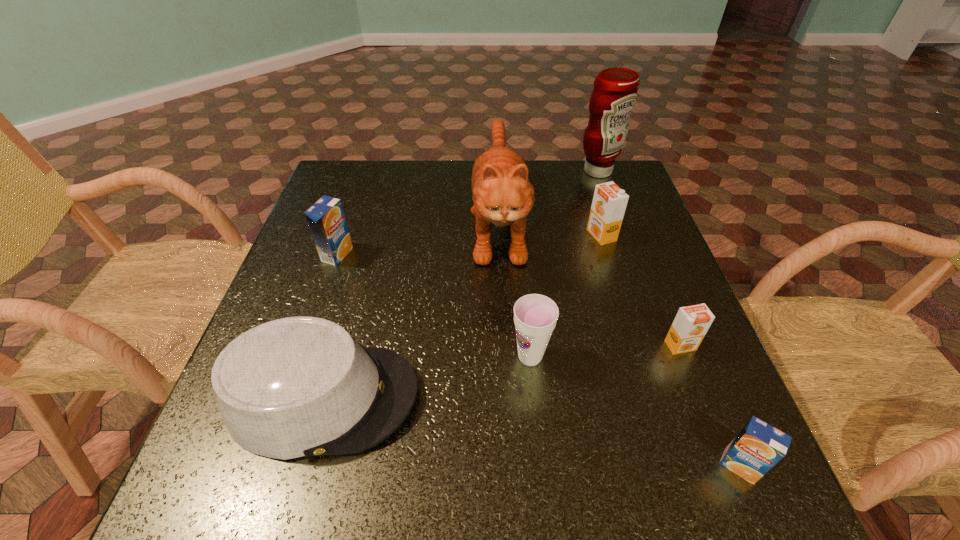
Where is `free spot at the far edge of the desktop`? The image size is (960, 540). free spot at the far edge of the desktop is located at coordinates (419, 195).

Find the location of a particular element. The image size is (960, 540). free spot at the left edge of the desktop is located at coordinates (359, 221).

Image resolution: width=960 pixels, height=540 pixels. I want to click on vacant space at the right edge of the desktop, so click(648, 368).

In the image, there is a desktop. At what (x,y) coordinates should I click in order to perform the action: click on vacant space at the far left corner. Please return your answer as a coordinate pair (x, y). Looking at the image, I should click on point(339,198).

This screenshot has height=540, width=960. I want to click on free location at the near left corner of the desktop, so click(287, 515).

Find the location of a particular element. This screenshot has height=540, width=960. free space at the far right corner of the desktop is located at coordinates (583, 190).

What are the coordinates of `empty location between the condiment and the nearer blue orange_juice` in the screenshot? It's located at (669, 319).

Locate an element on the screen. The image size is (960, 540). empty space between the orange cat and the bigger orange orange juice is located at coordinates (550, 229).

Where is `vacant point located between the orange cat and the hat`? The width and height of the screenshot is (960, 540). vacant point located between the orange cat and the hat is located at coordinates (411, 310).

At what (x,y) coordinates should I click in order to perform the action: click on free spot between the nearer blue orange_juice and the hat. Please return your answer as a coordinate pair (x, y). Looking at the image, I should click on (532, 431).